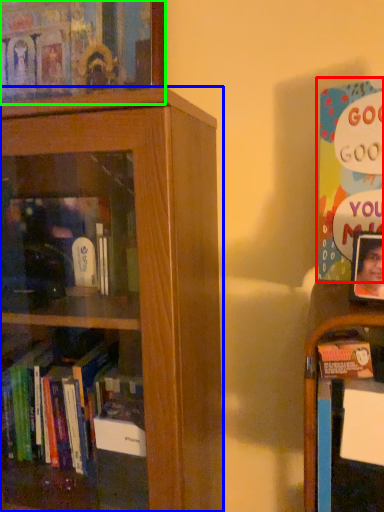
Question: Which object is positioned farthest from book (highlighted by a red box)? Select from bookcase (highlighted by a blue box) and book (highlighted by a green box).

Choices:
 (A) bookcase
 (B) book

Answer: (B)